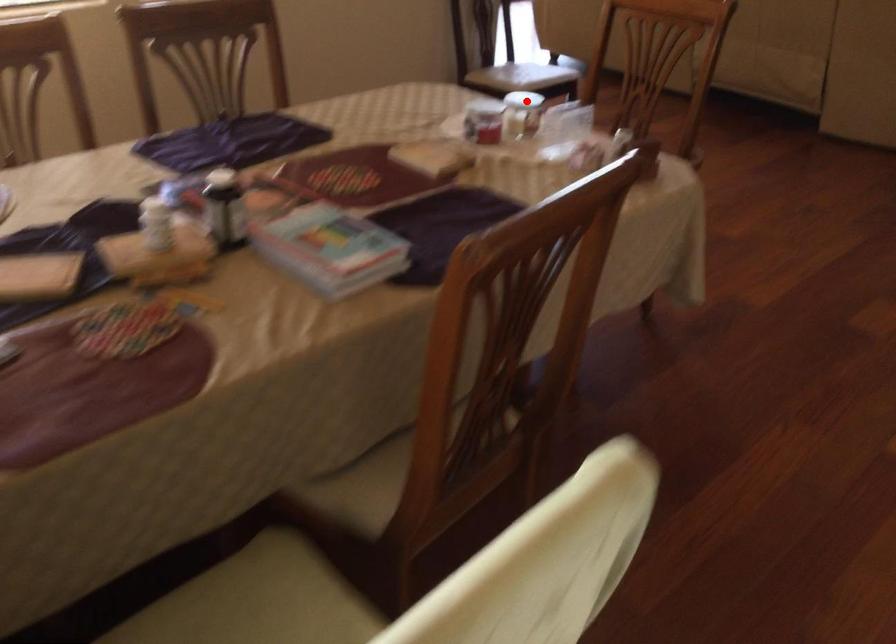
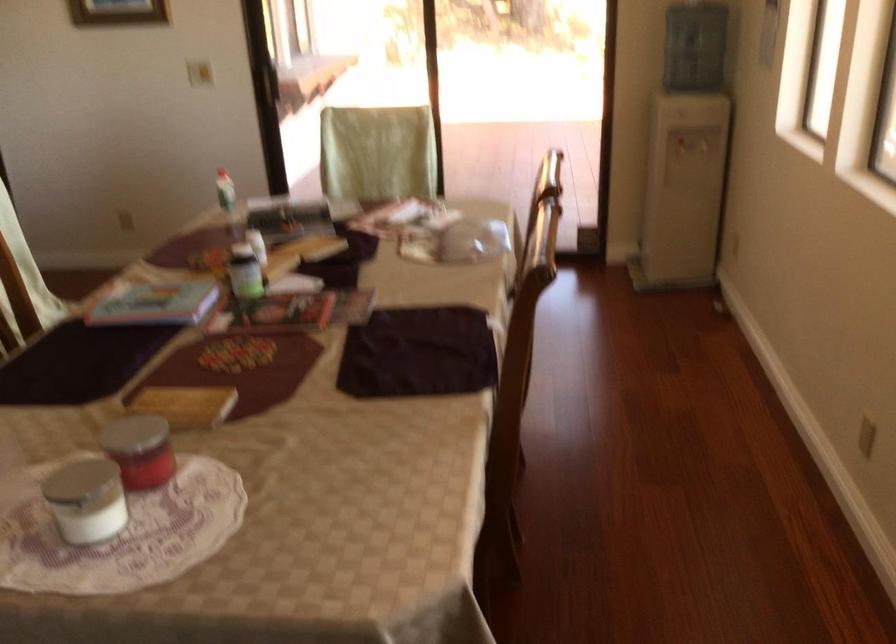
Find the pixel in the second image that matches the highlighted location in the first image.

(85, 500)